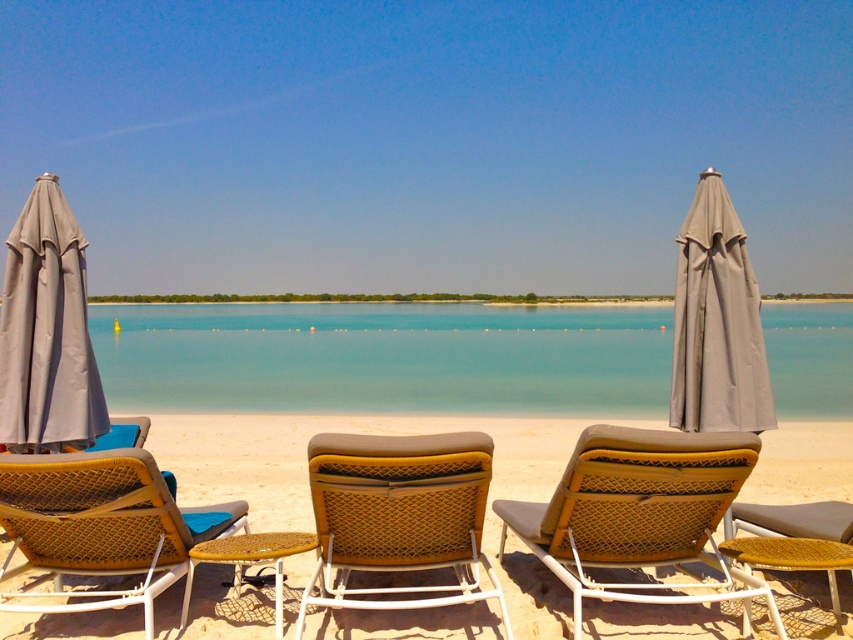
Question: Among these points, which one is nearest to the camera?

Choices:
 (A) (834, 609)
 (B) (457, 515)
 (C) (96, 420)
 (D) (709, 337)

Answer: (B)

Question: Is woven fabric beach chair at center below woven brown beach chair at lower left?

Choices:
 (A) no
 (B) yes

Answer: (A)

Question: Can you confirm if gray fabric umbrella at left is wider than woven brown beach chair at center?

Choices:
 (A) no
 (B) yes

Answer: (A)

Question: Which point is closer to the camera?

Choices:
 (A) (535, 488)
 (B) (598, 458)
 (C) (42, 561)

Answer: (B)

Question: Which of the following is the closest to the observer?

Choices:
 (A) (473, 568)
 (B) (442, 371)
 (C) (173, 532)
 (D) (80, 410)

Answer: (C)

Question: Can you confirm if gray fabric umbrella at left is thinner than gray fabric umbrella at right?

Choices:
 (A) yes
 (B) no

Answer: (A)